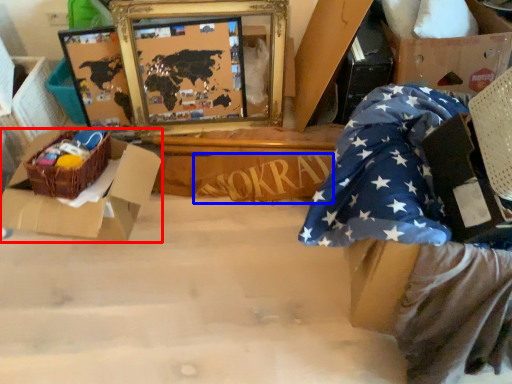
Question: Which object appears closest to the camera in this image, box (highlighted by a red box) or writing (highlighted by a blue box)?

Choices:
 (A) box
 (B) writing

Answer: (A)